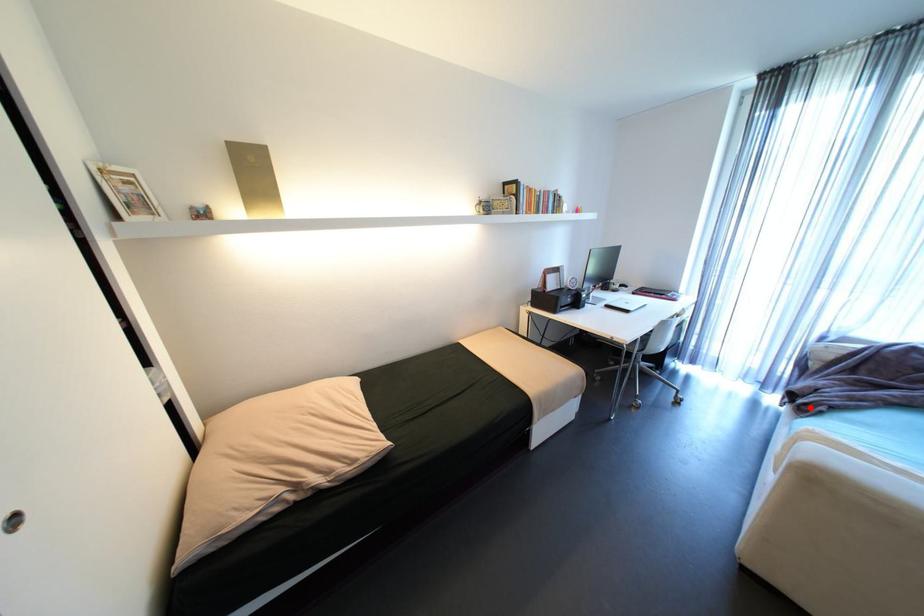
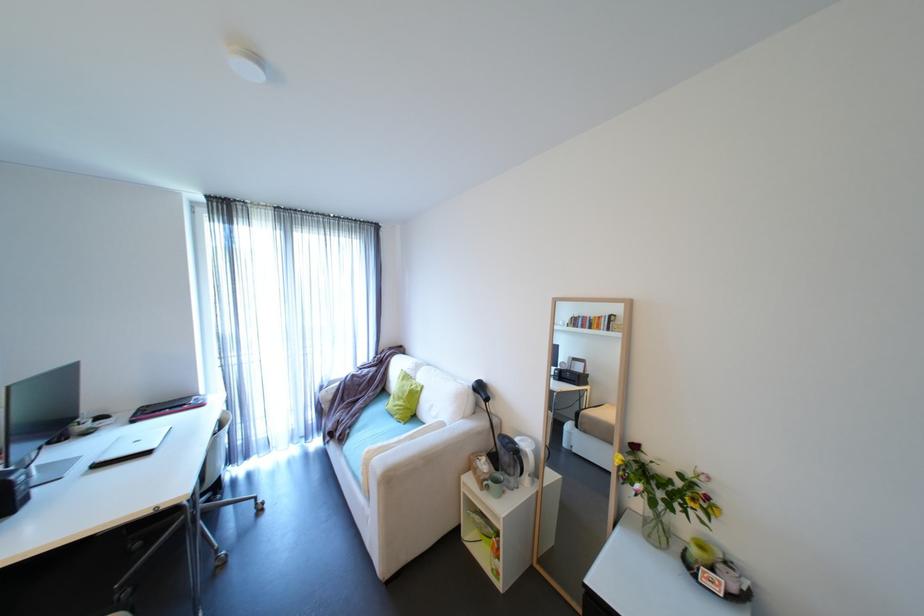
In the second image, find the point that corresponds to the highlighted location in the first image.

(347, 438)